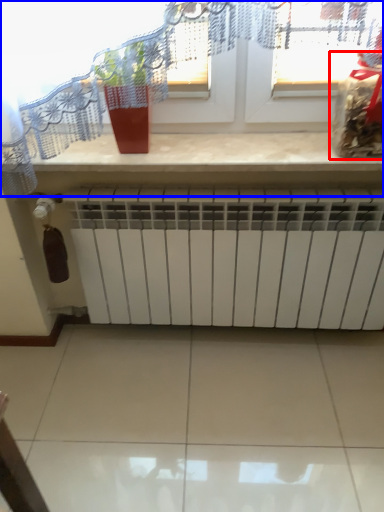
Question: Among these objects, which one is nearest to the camera, food (highlighted by a red box) or window (highlighted by a blue box)?

Choices:
 (A) food
 (B) window

Answer: (A)